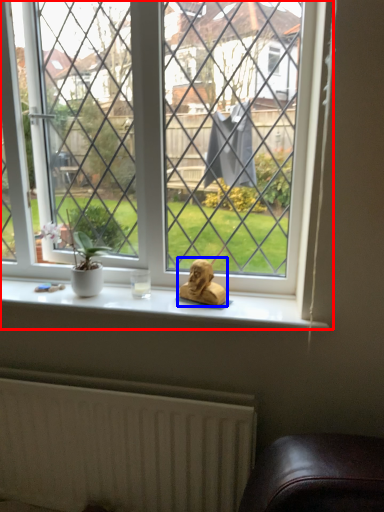
Question: Which object appears closest to the camera in this image, window (highlighted by a red box) or animal (highlighted by a blue box)?

Choices:
 (A) window
 (B) animal

Answer: (A)